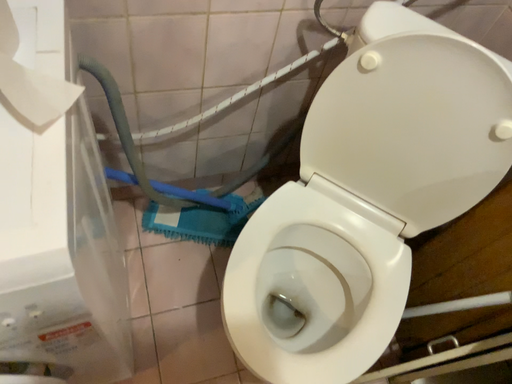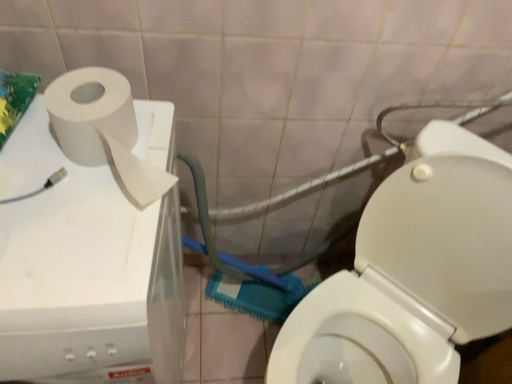
Question: How did the camera likely rotate when shooting the video?

Choices:
 (A) rotated right
 (B) rotated left

Answer: (B)